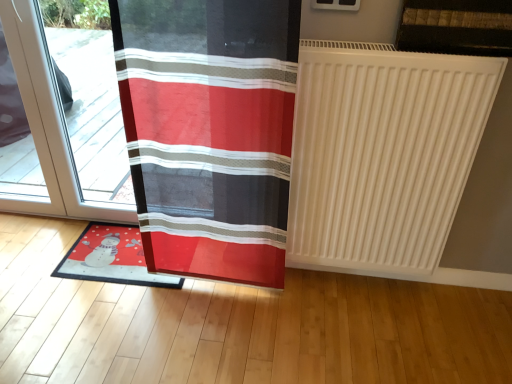
Question: Would you say matte plastic mat at lower left is outside white matte radiator at right?

Choices:
 (A) yes
 (B) no

Answer: (A)

Question: From a real-world perspective, does matte plastic mat at lower left sit lower than white matte radiator at right?

Choices:
 (A) yes
 (B) no

Answer: (A)

Question: Is matte plastic mat at lower left smaller than white matte radiator at right?

Choices:
 (A) yes
 (B) no

Answer: (A)

Question: Is matte plastic mat at lower left positioned in front of white matte radiator at right?

Choices:
 (A) no
 (B) yes

Answer: (A)

Question: Is matte plastic mat at lower left at the right side of white matte radiator at right?

Choices:
 (A) yes
 (B) no

Answer: (B)

Question: Considering the positions of matte plastic mat at lower left and transparent glass door at left in the image, is matte plastic mat at lower left wider or thinner than transparent glass door at left?

Choices:
 (A) wide
 (B) thin

Answer: (A)

Question: Visually, is matte plastic mat at lower left positioned to the left or to the right of transparent glass door at left?

Choices:
 (A) left
 (B) right

Answer: (B)

Question: Is matte plastic mat at lower left in front of or behind transparent glass door at left in the image?

Choices:
 (A) behind
 (B) front

Answer: (A)

Question: From the image's perspective, is matte plastic mat at lower left located above or below transparent glass door at left?

Choices:
 (A) below
 (B) above

Answer: (A)

Question: Considering the positions of transparent glass door at left and white matte radiator at right in the image, is transparent glass door at left taller or shorter than white matte radiator at right?

Choices:
 (A) short
 (B) tall

Answer: (B)

Question: From the image's perspective, is transparent glass door at left positioned above or below white matte radiator at right?

Choices:
 (A) below
 (B) above

Answer: (B)

Question: From a real-world perspective, is transparent glass door at left positioned above or below white matte radiator at right?

Choices:
 (A) below
 (B) above

Answer: (A)

Question: Considering the positions of transparent glass door at left and white matte radiator at right in the image, is transparent glass door at left bigger or smaller than white matte radiator at right?

Choices:
 (A) small
 (B) big

Answer: (A)

Question: In terms of width, does matte plastic mat at lower left look wider or thinner when compared to white matte radiator at right?

Choices:
 (A) thin
 (B) wide

Answer: (B)

Question: From a real-world perspective, is matte plastic mat at lower left positioned above or below white matte radiator at right?

Choices:
 (A) above
 (B) below

Answer: (B)